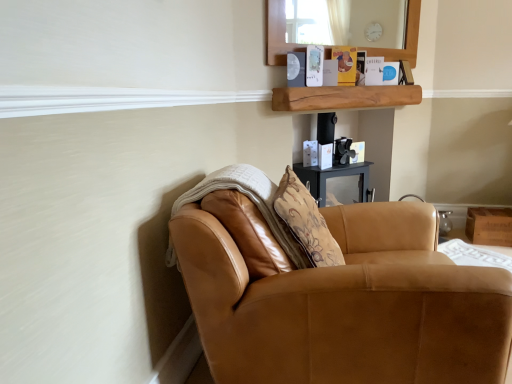
The height and width of the screenshot is (384, 512). What are the coordinates of `saddle brown leather chair at lower right` in the screenshot? It's located at (336, 293).

Is natural wood shelf at upper center in contact with saddle brown leather chair at lower right?

No, natural wood shelf at upper center is not beside saddle brown leather chair at lower right.

Measure the distance between natural wood shelf at upper center and saddle brown leather chair at lower right.

natural wood shelf at upper center and saddle brown leather chair at lower right are 4.46 feet apart from each other.

Is point (296, 90) positioned behind point (346, 337)?

Yes, point (296, 90) is behind point (346, 337).

Considering the sizes of natural wood shelf at upper center and saddle brown leather chair at lower right in the image, is natural wood shelf at upper center taller or shorter than saddle brown leather chair at lower right?

Clearly, natural wood shelf at upper center is shorter compared to saddle brown leather chair at lower right.

Measure the distance from saddle brown leather chair at lower right to wooden box at lower right.

saddle brown leather chair at lower right and wooden box at lower right are 7.32 feet apart.

Find the location of a particular element. chair located below the wooden box at lower right (from the image's perspective) is located at coordinates tap(336, 293).

How many degrees apart are the facing directions of saddle brown leather chair at lower right and wooden box at lower right?

saddle brown leather chair at lower right and wooden box at lower right are facing 98.2 degrees away from each other.

Which object is closer to the camera, saddle brown leather chair at lower right or wooden box at lower right?

saddle brown leather chair at lower right is closer to the camera.

Is saddle brown leather chair at lower right looking in the opposite direction of natural wood shelf at upper center?

No, natural wood shelf at upper center is not at the back of saddle brown leather chair at lower right.

Consider the image. Is saddle brown leather chair at lower right behind natural wood shelf at upper center?

No, saddle brown leather chair at lower right is closer to the camera.

What are the coordinates of `shelf located above the saddle brown leather chair at lower right (from a real-world perspective)` in the screenshot? It's located at (343, 97).

Is saddle brown leather chair at lower right to the right of natural wood shelf at upper center from the viewer's perspective?

Incorrect, saddle brown leather chair at lower right is not on the right side of natural wood shelf at upper center.

In order to click on box lying behind the saddle brown leather chair at lower right in this screenshot , I will do `click(489, 226)`.

Who is shorter, wooden box at lower right or saddle brown leather chair at lower right?

Standing shorter between the two is wooden box at lower right.

Does point (507, 210) lie in front of point (300, 200)?

No, (507, 210) is behind (300, 200).

Would you say wooden box at lower right contains saddle brown leather chair at lower right?

Definitely not — saddle brown leather chair at lower right is not inside wooden box at lower right.

Are natural wood shelf at upper center and wooden box at lower right making contact?

They are not placed beside each other.

Is natural wood shelf at upper center bigger than wooden box at lower right?

Indeed, natural wood shelf at upper center has a larger size compared to wooden box at lower right.

Is natural wood shelf at upper center behind wooden box at lower right?

No, natural wood shelf at upper center is in front of wooden box at lower right.

In the scene shown: Is natural wood shelf at upper center facing towards wooden box at lower right?

No, natural wood shelf at upper center is not oriented towards wooden box at lower right.

Which object is further away from the camera, wooden box at lower right or natural wood shelf at upper center?

Positioned behind is wooden box at lower right.

Which of these two, wooden box at lower right or natural wood shelf at upper center, stands taller?

wooden box at lower right.

Considering the relative sizes of wooden box at lower right and natural wood shelf at upper center in the image provided, is wooden box at lower right thinner than natural wood shelf at upper center?

No.

Find the location of a particular element. The image size is (512, 384). shelf above the wooden box at lower right (from a real-world perspective) is located at coordinates (343, 97).

At what (x,y) coordinates should I click in order to perform the action: click on shelf above the saddle brown leather chair at lower right (from a real-world perspective). Please return your answer as a coordinate pair (x, y). The width and height of the screenshot is (512, 384). Looking at the image, I should click on pos(343,97).

At what (x,y) coordinates should I click in order to perform the action: click on box behind the saddle brown leather chair at lower right. Please return your answer as a coordinate pair (x, y). This screenshot has height=384, width=512. Looking at the image, I should click on pyautogui.click(x=489, y=226).

Considering their positions, is wooden box at lower right positioned closer to natural wood shelf at upper center than saddle brown leather chair at lower right?

wooden box at lower right lies closer to natural wood shelf at upper center than the other object.

Based on their spatial positions, is saddle brown leather chair at lower right or natural wood shelf at upper center closer to wooden box at lower right?

natural wood shelf at upper center is closer to wooden box at lower right.

Based on their spatial positions, is wooden box at lower right or natural wood shelf at upper center closer to saddle brown leather chair at lower right?

The object closer to saddle brown leather chair at lower right is natural wood shelf at upper center.

Looking at the image, which one is located further to natural wood shelf at upper center, saddle brown leather chair at lower right or wooden box at lower right?

saddle brown leather chair at lower right.

When comparing their distances from wooden box at lower right, does natural wood shelf at upper center or saddle brown leather chair at lower right seem further?

Among the two, saddle brown leather chair at lower right is located further to wooden box at lower right.

When comparing their distances from saddle brown leather chair at lower right, does natural wood shelf at upper center or wooden box at lower right seem further?

wooden box at lower right lies further to saddle brown leather chair at lower right than the other object.

You are a GUI agent. You are given a task and a screenshot of the screen. Output one action in this format:
    pyautogui.click(x=<x>, y=<y>)
    Task: Click on the shelf between saddle brown leather chair at lower right and wooden box at lower right along the z-axis
    
    Given the screenshot: What is the action you would take?
    pyautogui.click(x=343, y=97)